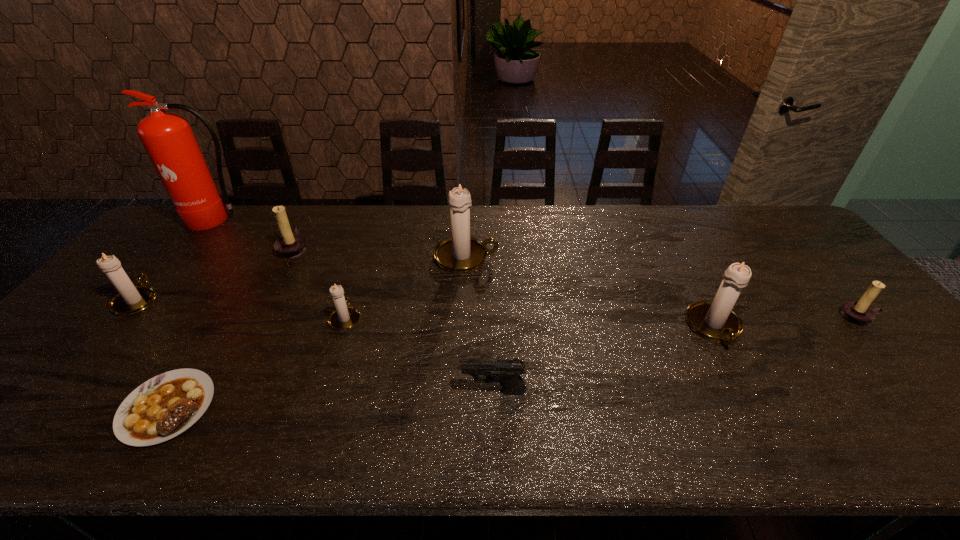
Where is `vacant space at the left edge of the desktop`? The height and width of the screenshot is (540, 960). vacant space at the left edge of the desktop is located at coordinates (170, 249).

In order to click on free region at the near left corner of the desktop in this screenshot , I will do `click(28, 451)`.

The height and width of the screenshot is (540, 960). I want to click on vacant space at the far right corner of the desktop, so click(769, 232).

You are a GUI agent. You are given a task and a screenshot of the screen. Output one action in this format:
    pyautogui.click(x=<x>, y=<y>)
    Task: Click on the free space between the smaller brown candle holder and the tallest candle holder
    
    Given the screenshot: What is the action you would take?
    pyautogui.click(x=662, y=287)

This screenshot has height=540, width=960. I want to click on free space between the farthest white candle holder and the fifth object from left to right, so click(406, 287).

This screenshot has height=540, width=960. Find the location of `free area in between the left brown candle holder and the rightmost object`. free area in between the left brown candle holder and the rightmost object is located at coordinates (576, 282).

Find the location of a particular element. free space between the farthest object and the steak is located at coordinates (193, 313).

You are a GUI agent. You are given a task and a screenshot of the screen. Output one action in this format:
    pyautogui.click(x=<x>, y=<y>)
    Task: Click on the free space between the rightmost white candle holder and the second tallest object
    
    Given the screenshot: What is the action you would take?
    pyautogui.click(x=590, y=293)

I want to click on free space between the fourth candle holder from left to right and the black pistol, so click(480, 324).

At what (x,y) coordinates should I click in order to perform the action: click on empty location between the leftmost white candle holder and the shortest object. Please return your answer as a coordinate pair (x, y). This screenshot has height=540, width=960. Looking at the image, I should click on (153, 353).